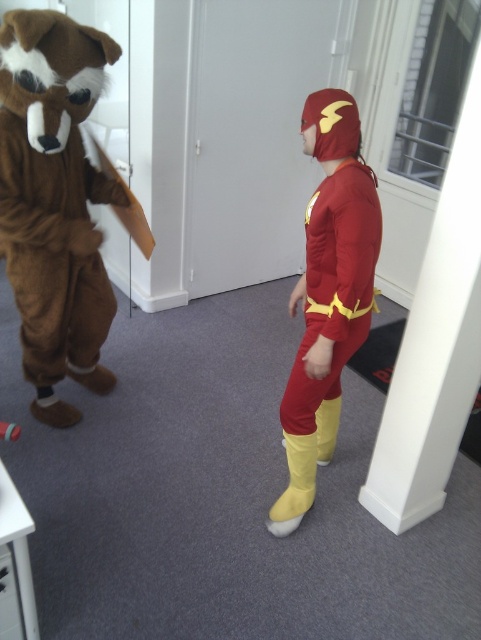
You are a photographer at a costume party and need to position the brown furry costume at left and the shiny red fabric superhero suit at center for a group photo. Based on their current positions, which costume is closer to the left side of the photo?

The brown furry costume at left is closer to the left side of the photo because it is positioned to the left of the shiny red fabric superhero suit at center.

You are organizing a costume party and need to store the costumes in a closet. The brown furry costume at left and the shiny red fabric superhero suit at center must be stored. Given that the closet has limited space, which costume should you store first to maximize space efficiency?

The shiny red fabric superhero suit at center should be stored first because the brown furry costume at left is bigger and will require more space, so storing the smaller one first allows the larger one to be placed afterward without overcrowding.